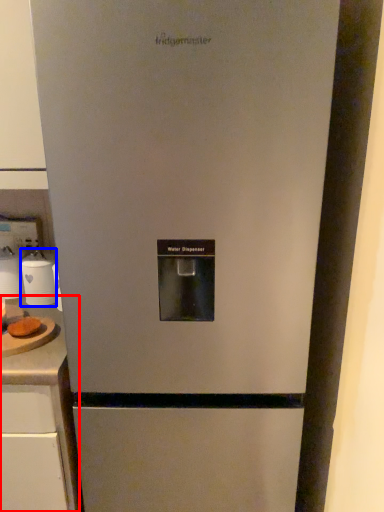
Question: Which of the following is the closest to the observer, counter top (highlighted by a red box) or appliance (highlighted by a blue box)?

Choices:
 (A) counter top
 (B) appliance

Answer: (A)